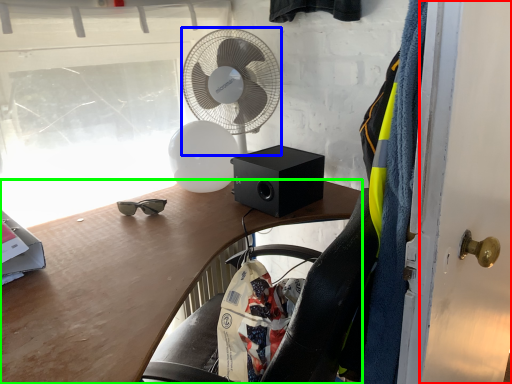
Question: Based on their relative distances, which object is farther from door (highlighted by a red box)? Choose from mechanical fan (highlighted by a blue box) and desk (highlighted by a green box).

Choices:
 (A) mechanical fan
 (B) desk

Answer: (A)